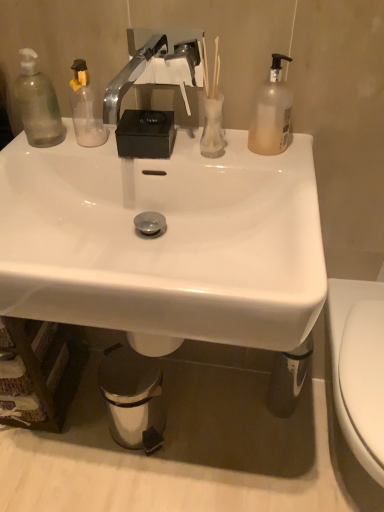
Question: Is white glossy sink at center further to the viewer compared to white glossy toilet at right?

Choices:
 (A) no
 (B) yes

Answer: (B)

Question: Does white glossy sink at center have a smaller size compared to white glossy toilet at right?

Choices:
 (A) yes
 (B) no

Answer: (A)

Question: Is white glossy sink at center far from white glossy toilet at right?

Choices:
 (A) yes
 (B) no

Answer: (B)

Question: From the image's perspective, is white glossy sink at center under white glossy toilet at right?

Choices:
 (A) yes
 (B) no

Answer: (B)

Question: Is white glossy sink at center at the right side of white glossy toilet at right?

Choices:
 (A) yes
 (B) no

Answer: (B)

Question: From the image's perspective, is white glossy toilet at right positioned above or below transparent glass vase at upper center?

Choices:
 (A) below
 (B) above

Answer: (A)

Question: Is white glossy toilet at right situated inside transparent glass vase at upper center or outside?

Choices:
 (A) outside
 (B) inside

Answer: (A)

Question: Is white glossy toilet at right bigger or smaller than transparent glass vase at upper center?

Choices:
 (A) small
 (B) big

Answer: (B)

Question: From a real-world perspective, relative to transparent glass vase at upper center, is white glossy toilet at right vertically above or below?

Choices:
 (A) below
 (B) above

Answer: (A)

Question: Considering the positions of translucent plastic bottle at upper right, placed as the 2th bottle when sorted from left to right, and shiny metallic trash can at lower center in the image, is translucent plastic bottle at upper right, placed as the 2th bottle when sorted from left to right, wider or thinner than shiny metallic trash can at lower center?

Choices:
 (A) wide
 (B) thin

Answer: (B)

Question: Is translucent plastic bottle at upper right, placed as the first bottle when sorted from right to left, taller or shorter than shiny metallic trash can at lower center?

Choices:
 (A) short
 (B) tall

Answer: (A)

Question: Is translucent plastic bottle at upper right, placed as the first bottle when sorted from right to left, to the left or to the right of shiny metallic trash can at lower center in the image?

Choices:
 (A) right
 (B) left

Answer: (A)

Question: In terms of size, does translucent plastic bottle at upper right, placed as the 2th bottle when sorted from left to right, appear bigger or smaller than shiny metallic trash can at lower center?

Choices:
 (A) big
 (B) small

Answer: (B)

Question: From a real-world perspective, relative to white glossy toilet at right, is shiny metallic trash can at lower center vertically above or below?

Choices:
 (A) above
 (B) below

Answer: (B)

Question: From the image's perspective, relative to white glossy toilet at right, is shiny metallic trash can at lower center above or below?

Choices:
 (A) below
 (B) above

Answer: (A)